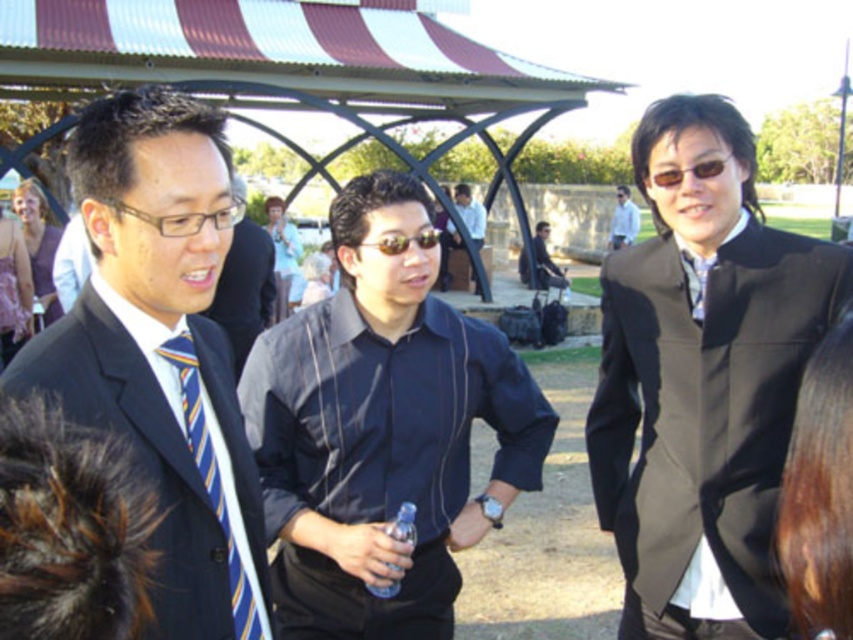
Question: Which object appears farthest from the camera in this image?

Choices:
 (A) matte black shirt at center
 (B) white glossy shirt at center
 (C) dark blue striped shirt at center
 (D) matte black suit at left

Answer: (B)

Question: Can you confirm if striped silk tie at left is positioned below white glossy shirt at center?

Choices:
 (A) no
 (B) yes

Answer: (B)

Question: Does black satin suit at center have a greater width compared to white glossy shirt at center?

Choices:
 (A) no
 (B) yes

Answer: (B)

Question: Is dark blue shirt at center thinner than white glossy shirt at center?

Choices:
 (A) no
 (B) yes

Answer: (A)

Question: Which object is farther from the camera taking this photo?

Choices:
 (A) striped silk tie at left
 (B) matte black suit at left
 (C) black satin suit at center
 (D) white glossy shirt at center

Answer: (D)

Question: Which point appears farthest from the camera in this image?

Choices:
 (A) (448, 241)
 (B) (230, 548)
 (C) (247, 328)

Answer: (A)